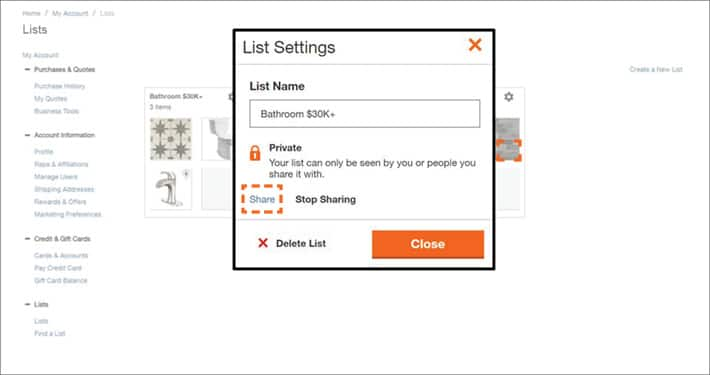
The image size is (710, 375). I want to click on taps, so click(167, 170).